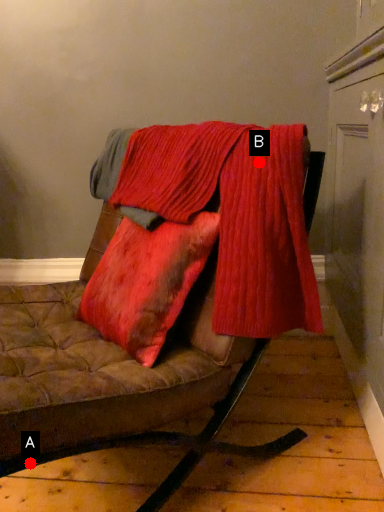
Question: Two points are circled on the image, labeled by A and B beside each circle. Which of the following is the closest to the observer?

Choices:
 (A) A is closer
 (B) B is closer

Answer: (A)